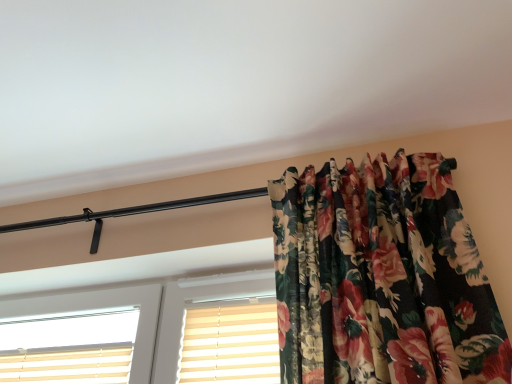
Question: Is the position of beige striped shutter at center more distant than that of white plastic window at center?

Choices:
 (A) yes
 (B) no

Answer: (A)

Question: Would you say beige striped shutter at center contains white plastic window at center?

Choices:
 (A) no
 (B) yes

Answer: (A)

Question: Can you confirm if beige striped shutter at center is taller than white plastic window at center?

Choices:
 (A) yes
 (B) no

Answer: (B)

Question: Is beige striped shutter at center closer to camera compared to white plastic window at center?

Choices:
 (A) yes
 (B) no

Answer: (B)

Question: Is beige striped shutter at center far away from white plastic window at center?

Choices:
 (A) no
 (B) yes

Answer: (A)

Question: Is beige striped shutter at center at the left side of white plastic window at center?

Choices:
 (A) yes
 (B) no

Answer: (B)

Question: From a real-world perspective, is white plastic window at center physically below beige striped shutter at center?

Choices:
 (A) yes
 (B) no

Answer: (B)

Question: Is the surface of white plastic window at center in direct contact with beige striped shutter at center?

Choices:
 (A) yes
 (B) no

Answer: (B)

Question: Is white plastic window at center at the left side of beige striped shutter at center?

Choices:
 (A) yes
 (B) no

Answer: (A)

Question: Considering the relative sizes of white plastic window at center and beige striped shutter at center in the image provided, is white plastic window at center taller than beige striped shutter at center?

Choices:
 (A) no
 (B) yes

Answer: (B)

Question: Can you confirm if white plastic window at center is positioned to the right of beige striped shutter at center?

Choices:
 (A) no
 (B) yes

Answer: (A)

Question: Does white plastic window at center turn towards beige striped shutter at center?

Choices:
 (A) no
 (B) yes

Answer: (B)

Question: Is beige striped shutter at center wider or thinner than white plastic window at center?

Choices:
 (A) thin
 (B) wide

Answer: (A)